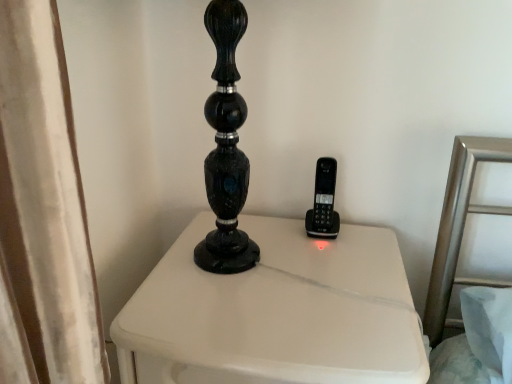
Where is `vacant region to the left of black plastic phone at center`? Image resolution: width=512 pixels, height=384 pixels. vacant region to the left of black plastic phone at center is located at coordinates (265, 229).